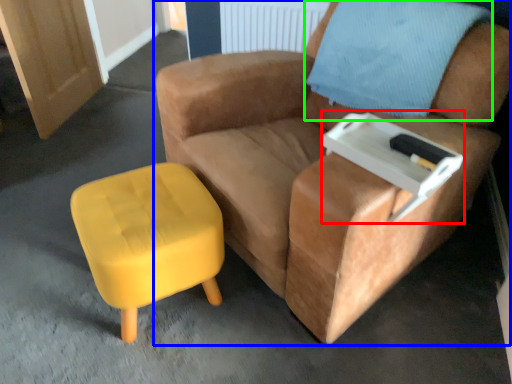
Question: Which object is the closest to the side table (highlighted by a red box)? Choose among these: chair (highlighted by a blue box) or pillow (highlighted by a green box).

Choices:
 (A) chair
 (B) pillow

Answer: (A)